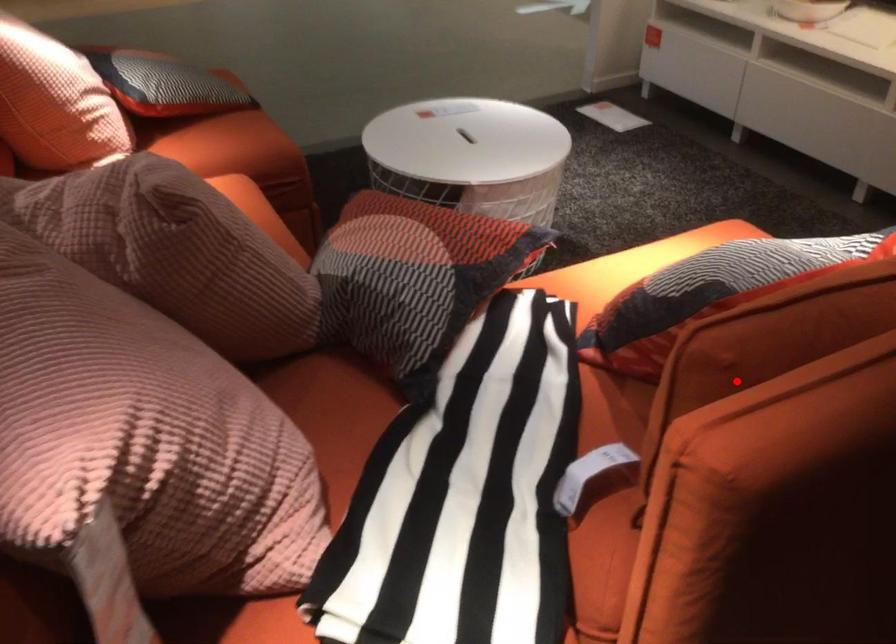
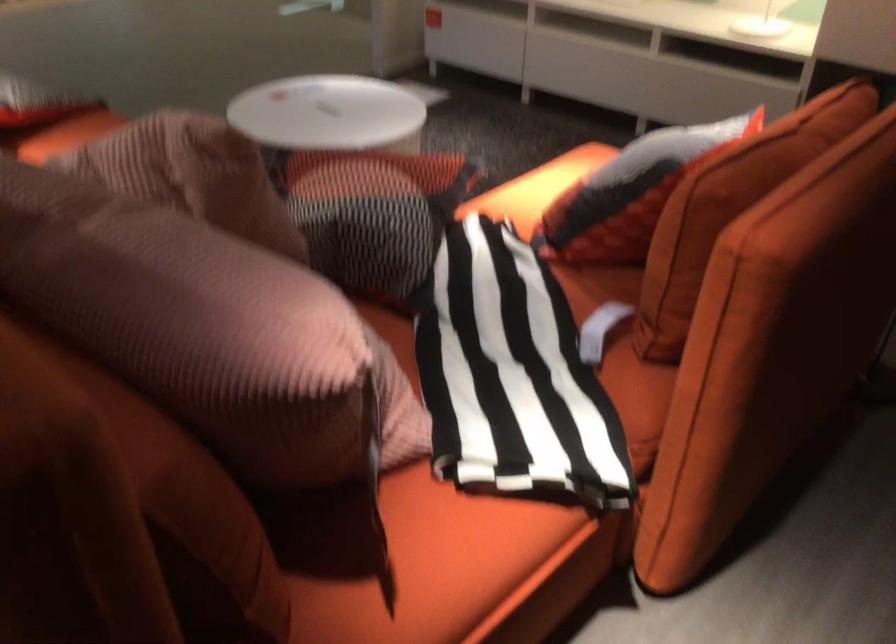
In the second image, find the point that corresponds to the highlighted location in the first image.

(730, 207)